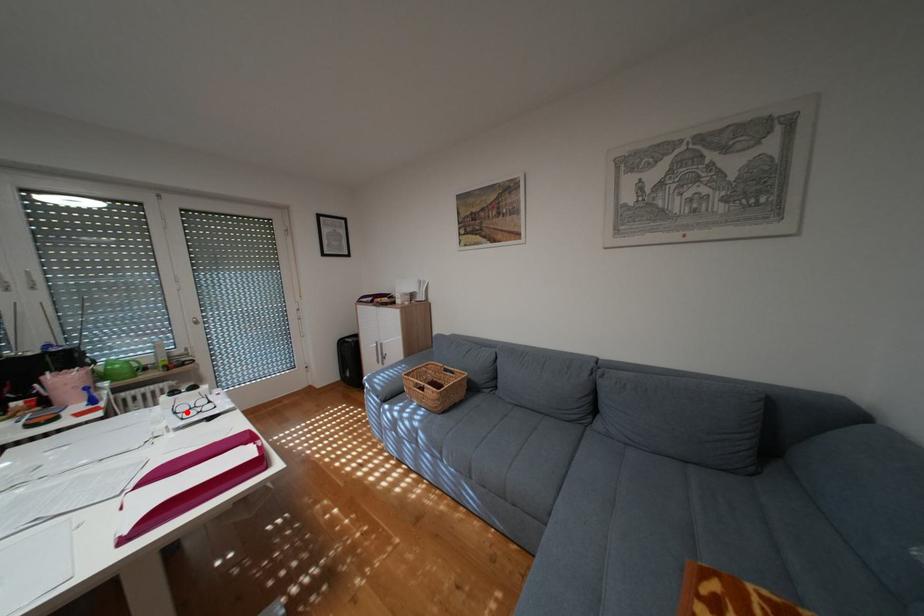
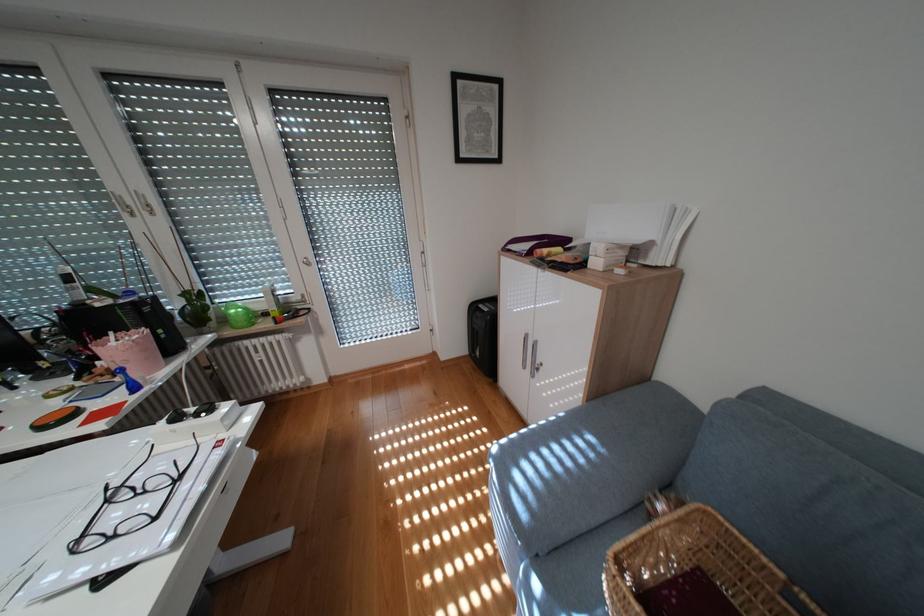
Locate, in the second image, the point that corresponds to the highlighted location in the first image.

(119, 501)